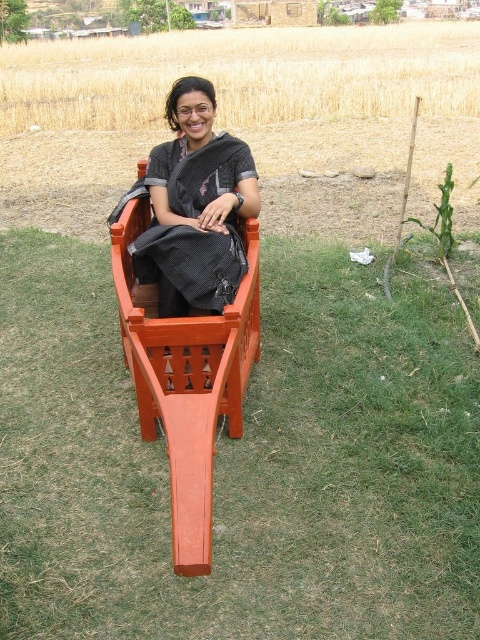
Question: Which point is farther to the camera?

Choices:
 (A) orange wood chair at center
 (B) black woven saree at center

Answer: (B)

Question: Which point is farther from the camera taking this photo?

Choices:
 (A) (187, 186)
 (B) (179, 481)

Answer: (A)

Question: Does orange wood chair at center have a greater width compared to black woven saree at center?

Choices:
 (A) no
 (B) yes

Answer: (B)

Question: Does orange wood chair at center have a larger size compared to black woven saree at center?

Choices:
 (A) yes
 (B) no

Answer: (A)

Question: Among these objects, which one is nearest to the camera?

Choices:
 (A) orange wood chair at center
 (B) black woven saree at center

Answer: (A)

Question: Is orange wood chair at center thinner than black woven saree at center?

Choices:
 (A) no
 (B) yes

Answer: (A)